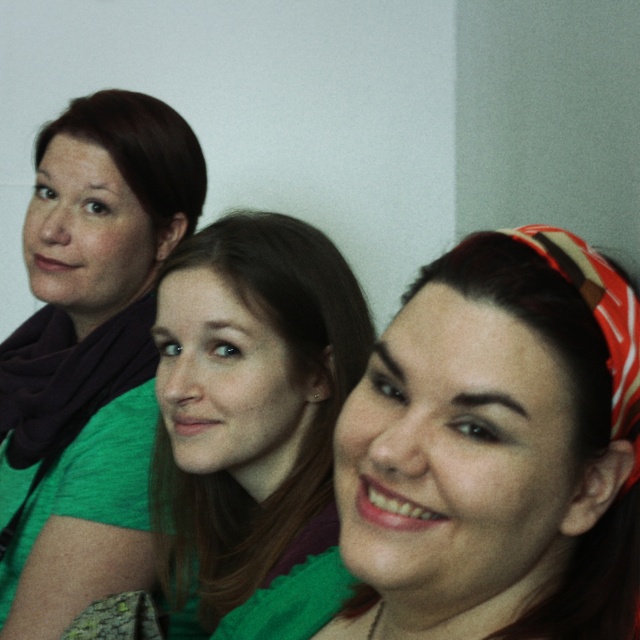
Which is more to the right, green knitted scarf at center or matte black scarf at left?

From the viewer's perspective, green knitted scarf at center appears more on the right side.

Which of these two, green knitted scarf at center or matte black scarf at left, stands shorter?

Standing shorter between the two is green knitted scarf at center.

Where is `green knitted scarf at center`? This screenshot has height=640, width=640. green knitted scarf at center is located at coordinates (250, 397).

Is matte green scarf at center taller than matte black scarf at left?

Incorrect, matte green scarf at center's height is not larger of matte black scarf at left's.

In the scene shown: Measure the distance between matte green scarf at center and matte black scarf at left.

matte green scarf at center and matte black scarf at left are 29.84 inches apart.

This screenshot has height=640, width=640. What do you see at coordinates (474, 426) in the screenshot?
I see `matte green scarf at center` at bounding box center [474, 426].

This screenshot has height=640, width=640. In order to click on matte green scarf at center in this screenshot , I will do `click(474, 426)`.

Who is positioned more to the left, matte green scarf at center or green knitted scarf at center?

green knitted scarf at center

You are a GUI agent. You are given a task and a screenshot of the screen. Output one action in this format:
    pyautogui.click(x=<x>, y=<y>)
    Task: Click on the matte green scarf at center
    The height and width of the screenshot is (640, 640).
    Given the screenshot: What is the action you would take?
    474,426

Is point (256, 602) positioned behind point (193, 509)?

No, (256, 602) is closer to viewer.

The image size is (640, 640). I want to click on matte green scarf at center, so click(x=474, y=426).